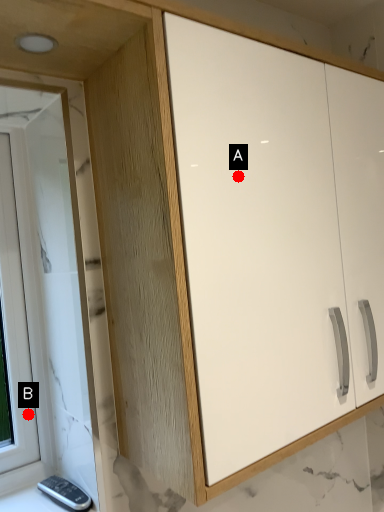
Question: Two points are circled on the image, labeled by A and B beside each circle. Which of the following is the farthest from the observer?

Choices:
 (A) A is further
 (B) B is further

Answer: (B)